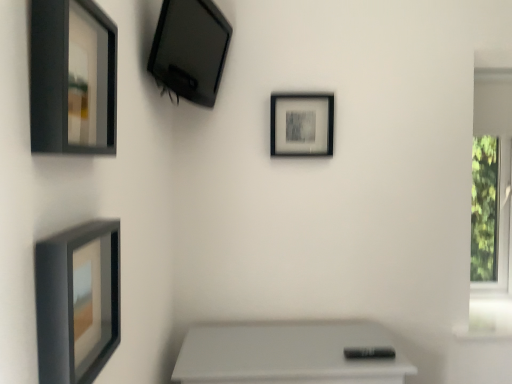
What do you see at coordinates (490, 206) in the screenshot?
I see `white plastic window frame at right` at bounding box center [490, 206].

Describe the element at coordinates (302, 124) in the screenshot. I see `matte black picture frame at center, which is the third picture frame from bottom to top` at that location.

Describe the element at coordinates (72, 78) in the screenshot. This screenshot has width=512, height=384. I see `matte black picture frame at upper left, placed as the first picture frame when sorted from left to right` at that location.

Describe the element at coordinates (78, 301) in the screenshot. I see `matte black picture frame at lower left, which appears as the 2th picture frame when viewed from the left` at that location.

Where is `white plastic window frame at right`? white plastic window frame at right is located at coordinates tap(490, 206).

Is white plastic window frame at right not near matte black picture frame at lower left, placed as the first picture frame when sorted from bottom to top?

That's right, there is a large distance between white plastic window frame at right and matte black picture frame at lower left, placed as the first picture frame when sorted from bottom to top.

Is white plastic window frame at right smaller than matte black picture frame at lower left, arranged as the 4th picture frame when viewed from the top?

No.

Could you tell me if white plastic window frame at right is turned towards matte black picture frame at lower left, which appears as the 2th picture frame when viewed from the left?

No, white plastic window frame at right is not aimed at matte black picture frame at lower left, which appears as the 2th picture frame when viewed from the left.

Is white plastic window frame at right inside matte black picture frame at lower left, the 3th picture frame in the right-to-left sequence?

No, white plastic window frame at right is not surrounded by matte black picture frame at lower left, the 3th picture frame in the right-to-left sequence.

Who is taller, matte black picture frame at lower left, the second picture frame positioned from the front, or white plastic window frame at right?

With more height is white plastic window frame at right.

Are matte black picture frame at lower left, which appears as the 2th picture frame when viewed from the left, and white plastic window frame at right located far from each other?

matte black picture frame at lower left, which appears as the 2th picture frame when viewed from the left, is far away from white plastic window frame at right.

Would you say matte black picture frame at lower left, arranged as the 4th picture frame when viewed from the top, is to the left or to the right of white plastic window frame at right in the picture?

Clearly, matte black picture frame at lower left, arranged as the 4th picture frame when viewed from the top, is on the left of white plastic window frame at right in the image.

Image resolution: width=512 pixels, height=384 pixels. I want to click on the 2nd picture frame counting from the left of the matte black tv at upper left, the 4th picture frame from the bottom, so click(72, 78).

Does matte black picture frame at upper left, which is counted as the third picture frame, starting from the top, appear on the right side of matte black tv at upper left, the 1th picture frame when ordered from top to bottom?

Incorrect, matte black picture frame at upper left, which is counted as the third picture frame, starting from the top, is not on the right side of matte black tv at upper left, the 1th picture frame when ordered from top to bottom.

Is matte black picture frame at upper left, which appears as the 4th picture frame when viewed from the right, positioned far away from matte black tv at upper left, the 1th picture frame when ordered from top to bottom?

No, matte black picture frame at upper left, which appears as the 4th picture frame when viewed from the right, is not far away from matte black tv at upper left, the 1th picture frame when ordered from top to bottom.

Based on their sizes in the image, would you say matte black picture frame at upper left, which is counted as the third picture frame, starting from the top, is bigger or smaller than matte black tv at upper left, placed as the 2th picture frame when sorted from right to left?

In the image, matte black picture frame at upper left, which is counted as the third picture frame, starting from the top, appears to be smaller than matte black tv at upper left, placed as the 2th picture frame when sorted from right to left.

Considering the points (157, 81) and (88, 304), which point is in front, point (157, 81) or point (88, 304)?

The point (88, 304) is closer to the camera.

How far apart are matte black tv at upper left, the 4th picture frame from the bottom, and matte black picture frame at lower left, positioned as the third picture frame in back-to-front order?

matte black tv at upper left, the 4th picture frame from the bottom, and matte black picture frame at lower left, positioned as the third picture frame in back-to-front order, are 32.02 inches apart from each other.

Is matte black tv at upper left, the 4th picture frame from the bottom, completely or partially outside of matte black picture frame at lower left, positioned as the third picture frame in back-to-front order?

matte black tv at upper left, the 4th picture frame from the bottom, is positioned outside matte black picture frame at lower left, positioned as the third picture frame in back-to-front order.

Would you say matte black tv at upper left, acting as the 2th picture frame starting from the back, is a long distance from matte black picture frame at lower left, arranged as the 4th picture frame when viewed from the top?

No, there isn't a large distance between matte black tv at upper left, acting as the 2th picture frame starting from the back, and matte black picture frame at lower left, arranged as the 4th picture frame when viewed from the top.

From a real-world perspective, is matte black picture frame at lower left, placed as the first picture frame when sorted from bottom to top, physically located above or below matte black picture frame at center, placed as the second picture frame when sorted from top to bottom?

From a real-world perspective, matte black picture frame at lower left, placed as the first picture frame when sorted from bottom to top, is physically below matte black picture frame at center, placed as the second picture frame when sorted from top to bottom.

How distant is matte black picture frame at lower left, placed as the first picture frame when sorted from bottom to top, from matte black picture frame at center, marked as the fourth picture frame in a left-to-right arrangement?

matte black picture frame at lower left, placed as the first picture frame when sorted from bottom to top, and matte black picture frame at center, marked as the fourth picture frame in a left-to-right arrangement, are 1.11 meters apart from each other.

Would you say matte black picture frame at lower left, arranged as the 4th picture frame when viewed from the top, contains matte black picture frame at center, which ranks as the fourth picture frame in front-to-back order?

No, matte black picture frame at center, which ranks as the fourth picture frame in front-to-back order, is not inside matte black picture frame at lower left, arranged as the 4th picture frame when viewed from the top.

Is matte black picture frame at center, which ranks as the fourth picture frame in front-to-back order, further to camera compared to matte black picture frame at upper left, which is counted as the third picture frame, starting from the top?

Yes.

Identify the location of picture frame that is the 1st one when counting downward from the matte black picture frame at center, which is the third picture frame from bottom to top (from the image's perspective). (72, 78).

Looking at this image, between matte black picture frame at center, the 1th picture frame in the back-to-front sequence, and matte black picture frame at upper left, the fourth picture frame in the back-to-front sequence, which one has smaller width?

matte black picture frame at center, the 1th picture frame in the back-to-front sequence.

Would you say matte black picture frame at upper left, the fourth picture frame in the back-to-front sequence, is part of matte black picture frame at center, which is the third picture frame from bottom to top,'s contents?

Definitely not — matte black picture frame at upper left, the fourth picture frame in the back-to-front sequence, is not inside matte black picture frame at center, which is the third picture frame from bottom to top.

Is matte black picture frame at lower left, the 3th picture frame in the right-to-left sequence, thinner than matte black picture frame at upper left, placed as the first picture frame when sorted from left to right?

No, matte black picture frame at lower left, the 3th picture frame in the right-to-left sequence, is not thinner than matte black picture frame at upper left, placed as the first picture frame when sorted from left to right.

Do you think matte black picture frame at lower left, the 3th picture frame in the right-to-left sequence, is within matte black picture frame at upper left, placed as the first picture frame when sorted from left to right, or outside of it?

The correct answer is: outside.

From a real-world perspective, which is physically above, matte black picture frame at lower left, placed as the first picture frame when sorted from bottom to top, or matte black picture frame at upper left, which is counted as the third picture frame, starting from the top?

matte black picture frame at upper left, which is counted as the third picture frame, starting from the top, is physically above.

Considering their positions, is matte black picture frame at lower left, arranged as the 4th picture frame when viewed from the top, located in front of or behind matte black picture frame at upper left, the fourth picture frame in the back-to-front sequence?

Visually, matte black picture frame at lower left, arranged as the 4th picture frame when viewed from the top, is located behind matte black picture frame at upper left, the fourth picture frame in the back-to-front sequence.

From the white plastic window frame at right, count 3rd picture frames forward and point to it. Please provide its 2D coordinates.

[(78, 301)]

Locate an element on the screen. The image size is (512, 384). window frame that is on the right side of matte black picture frame at lower left, placed as the first picture frame when sorted from bottom to top is located at coordinates (490, 206).

Considering their positions, is matte black tv at upper left, placed as the 2th picture frame when sorted from right to left, positioned closer to matte black picture frame at center, which ranks as the fourth picture frame in front-to-back order, than matte black picture frame at upper left, the 1th picture frame from the front?

Based on the image, matte black tv at upper left, placed as the 2th picture frame when sorted from right to left, appears to be nearer to matte black picture frame at center, which ranks as the fourth picture frame in front-to-back order.

Looking at the image, which one is located further to matte black picture frame at upper left, the fourth picture frame in the back-to-front sequence, white plastic window frame at right or matte black picture frame at lower left, which appears as the 2th picture frame when viewed from the left?

Based on the image, white plastic window frame at right appears to be further to matte black picture frame at upper left, the fourth picture frame in the back-to-front sequence.

Looking at the image, which one is located closer to matte black picture frame at upper left, the fourth picture frame in the back-to-front sequence, matte black tv at upper left, placed as the 2th picture frame when sorted from right to left, or matte black picture frame at center, marked as the fourth picture frame in a left-to-right arrangement?

matte black tv at upper left, placed as the 2th picture frame when sorted from right to left, is positioned closer to the anchor matte black picture frame at upper left, the fourth picture frame in the back-to-front sequence.

Looking at the image, which one is located closer to matte black picture frame at lower left, the second picture frame positioned from the front, white plastic window frame at right or matte black picture frame at center, placed as the second picture frame when sorted from top to bottom?

matte black picture frame at center, placed as the second picture frame when sorted from top to bottom, is positioned closer to the anchor matte black picture frame at lower left, the second picture frame positioned from the front.

Looking at the image, which one is located closer to matte black picture frame at lower left, which appears as the 2th picture frame when viewed from the left, white plastic window frame at right or matte black picture frame at upper left, which appears as the 4th picture frame when viewed from the right?

matte black picture frame at upper left, which appears as the 4th picture frame when viewed from the right.

In the scene shown: Which object lies nearer to the anchor point matte black picture frame at upper left, which is counted as the third picture frame, starting from the top, matte black tv at upper left, acting as the 2th picture frame starting from the back, or white plastic window frame at right?

The object closer to matte black picture frame at upper left, which is counted as the third picture frame, starting from the top, is matte black tv at upper left, acting as the 2th picture frame starting from the back.

Which object lies nearer to the anchor point matte black picture frame at upper left, placed as the first picture frame when sorted from left to right, matte black tv at upper left, placed as the 2th picture frame when sorted from right to left, or matte black picture frame at lower left, which appears as the 2th picture frame when viewed from the left?

matte black picture frame at lower left, which appears as the 2th picture frame when viewed from the left, lies closer to matte black picture frame at upper left, placed as the first picture frame when sorted from left to right, than the other object.

From the image, which object appears to be farther from matte black tv at upper left, placed as the 2th picture frame when sorted from right to left, matte black picture frame at lower left, the 3th picture frame in the right-to-left sequence, or matte black picture frame at upper left, placed as the first picture frame when sorted from left to right?

Based on the image, matte black picture frame at lower left, the 3th picture frame in the right-to-left sequence, appears to be further to matte black tv at upper left, placed as the 2th picture frame when sorted from right to left.

Where is `picture frame positioned between matte black picture frame at lower left, arranged as the 4th picture frame when viewed from the top, and matte black picture frame at center, the 1th picture frame positioned from the right, from near to far`? The height and width of the screenshot is (384, 512). picture frame positioned between matte black picture frame at lower left, arranged as the 4th picture frame when viewed from the top, and matte black picture frame at center, the 1th picture frame positioned from the right, from near to far is located at coordinates (190, 49).

Where is `picture frame between matte black tv at upper left, placed as the 2th picture frame when sorted from right to left, and white plastic window frame at right from left to right`? The height and width of the screenshot is (384, 512). picture frame between matte black tv at upper left, placed as the 2th picture frame when sorted from right to left, and white plastic window frame at right from left to right is located at coordinates (302, 124).